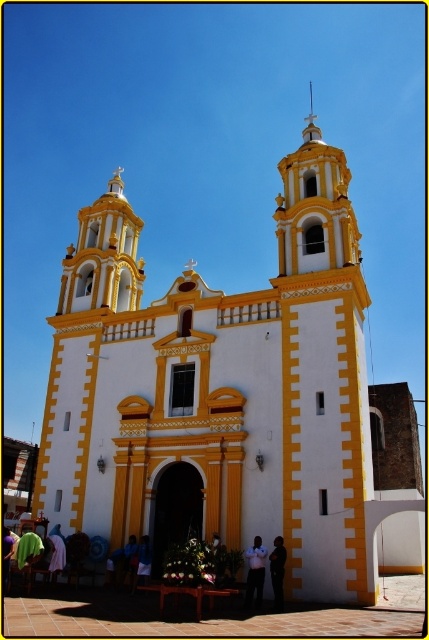
Can you confirm if white painted stone church at center is positioned above light brown leather jacket at lower center?

Indeed, white painted stone church at center is positioned over light brown leather jacket at lower center.

Can you confirm if white painted stone church at center is shorter than light brown leather jacket at lower center?

In fact, white painted stone church at center may be taller than light brown leather jacket at lower center.

Image resolution: width=429 pixels, height=640 pixels. What are the coordinates of `white painted stone church at center` in the screenshot? It's located at (218, 388).

Who is more distant from viewer, (x=262, y=547) or (x=280, y=588)?

Positioned behind is point (x=262, y=547).

Does light brown leather jacket at lower center have a lesser height compared to dark fabric shirt at center?

No, light brown leather jacket at lower center is not shorter than dark fabric shirt at center.

What are the coordinates of `light brown leather jacket at lower center` in the screenshot? It's located at (254, 572).

You are a GUI agent. You are given a task and a screenshot of the screen. Output one action in this format:
    pyautogui.click(x=<x>, y=<y>)
    Task: Click on the light brown leather jacket at lower center
    
    Given the screenshot: What is the action you would take?
    pyautogui.click(x=254, y=572)

Is light brown leather jacket at lower center bigger than dark blue fabric at lower center?

Correct, light brown leather jacket at lower center is larger in size than dark blue fabric at lower center.

Between point (247, 572) and point (151, 561), which one is positioned in front?

Point (247, 572) is more forward.

Locate an element on the screen. The width and height of the screenshot is (429, 640). light brown leather jacket at lower center is located at coordinates (254, 572).